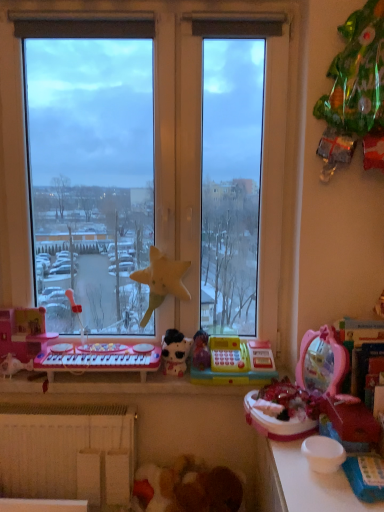
Question: Looking at the image, does pink plastic toy keyboard at left, acting as the second toy starting from the left, seem bigger or smaller compared to yellow fabric star at center, which is the 5th toy from right to left?

Choices:
 (A) small
 (B) big

Answer: (A)

Question: From their relative heights in the image, would you say pink plastic toy keyboard at left, which is the sixth toy in right-to-left order, is taller or shorter than yellow fabric star at center, which appears as the third toy when viewed from the left?

Choices:
 (A) short
 (B) tall

Answer: (A)

Question: Which is nearer to the pink plastic keyboard at lower left, the first toy viewed from the left?

Choices:
 (A) transparent glass window at center
 (B) white glossy plush at center, the fourth toy from the left
 (C) yellow plastic cash register at center, which is counted as the fifth toy, starting from the left
 (D) pink plastic toy at lower right, the sixth toy in the left-to-right sequence
 (E) blue plastic toy at lower right, which is the seventh toy from left to right

Answer: (B)

Question: Which object is the farthest from the white glossy plush at center, the 4th toy when ordered from right to left?

Choices:
 (A) transparent glass window at center
 (B) pink plastic musical keyboard at lower left
 (C) yellow plastic cash register at center, which is counted as the fifth toy, starting from the left
 (D) yellow fabric star at center, which appears as the third toy when viewed from the left
 (E) white matte radiator at lower left

Answer: (A)